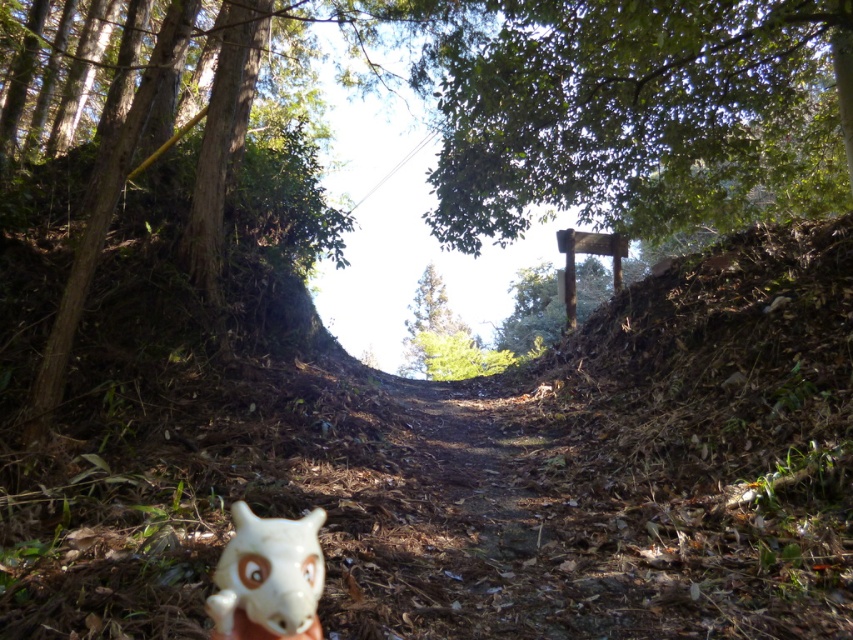
Is white matte plush toy at lower left to the left of green matte tree at center from the viewer's perspective?

Yes, white matte plush toy at lower left is to the left of green matte tree at center.

Identify the location of white matte plush toy at lower left. This screenshot has height=640, width=853. (268, 579).

The image size is (853, 640). Find the location of `white matte plush toy at lower left`. white matte plush toy at lower left is located at coordinates (268, 579).

Is green leafy tree at upper center closer to the viewer compared to green matte tree at center?

Yes, it is.

Which is in front, point (489, 145) or point (440, 330)?

Point (489, 145) is in front.

This screenshot has width=853, height=640. Find the location of `green leafy tree at upper center`. green leafy tree at upper center is located at coordinates (631, 113).

Is green leafy tree at upper center thinner than white matte plush toy at lower left?

No.

Who is lower down, green leafy tree at upper center or white matte plush toy at lower left?

Positioned lower is white matte plush toy at lower left.

Between point (468, 51) and point (315, 628), which one is positioned in front?

Point (315, 628) is more forward.

Locate an element on the screen. Image resolution: width=853 pixels, height=640 pixels. green leafy tree at upper center is located at coordinates (631, 113).